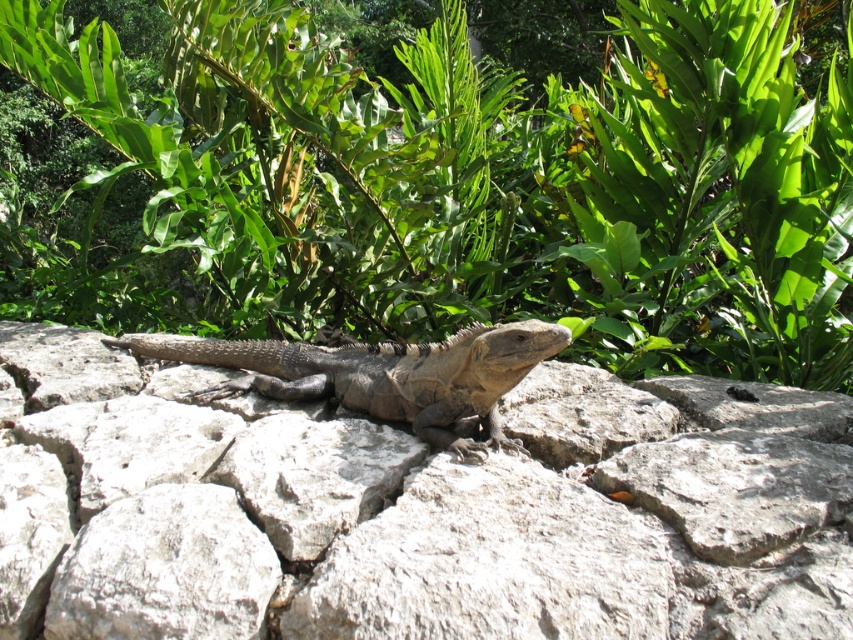
Question: Is the position of green leafy plant at center less distant than that of leathery brown lizard at center?

Choices:
 (A) no
 (B) yes

Answer: (A)

Question: Which of the following is the farthest from the observer?

Choices:
 (A) (305, 433)
 (B) (325, 394)
 (C) (843, 307)

Answer: (C)

Question: Which point appears closest to the camera in this image?

Choices:
 (A) (421, 484)
 (B) (495, 342)
 (C) (744, 144)

Answer: (A)

Question: Which point is closer to the camera?

Choices:
 (A) click(x=316, y=212)
 (B) click(x=229, y=381)
 (C) click(x=718, y=538)

Answer: (C)

Question: From the image, what is the correct spatial relationship of green leafy plant at center in relation to leathery brown lizard at center?

Choices:
 (A) above
 (B) below

Answer: (A)

Question: Is green leafy plant at center smaller than gray rough stone at center?

Choices:
 (A) yes
 (B) no

Answer: (B)